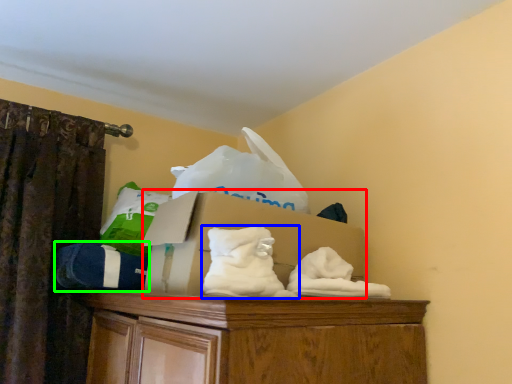
Question: Which object is the closest to the cardboard box (highlighted by a red box)? Choose among these: sheet (highlighted by a blue box) or clothing (highlighted by a green box).

Choices:
 (A) sheet
 (B) clothing

Answer: (A)